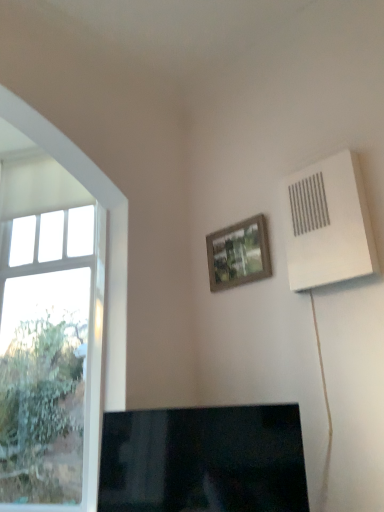
Question: Should I look upward or downward to see black glossy tv at lower center?

Choices:
 (A) down
 (B) up

Answer: (A)

Question: Is white plastic air conditioning unit at upper right facing away from clear glass window at left?

Choices:
 (A) no
 (B) yes

Answer: (A)

Question: Considering the relative sizes of white plastic air conditioning unit at upper right and clear glass window at left in the image provided, is white plastic air conditioning unit at upper right bigger than clear glass window at left?

Choices:
 (A) yes
 (B) no

Answer: (B)

Question: Is white plastic air conditioning unit at upper right further to camera compared to clear glass window at left?

Choices:
 (A) no
 (B) yes

Answer: (A)

Question: Is white plastic air conditioning unit at upper right not within clear glass window at left?

Choices:
 (A) no
 (B) yes

Answer: (B)

Question: From a real-world perspective, is white plastic air conditioning unit at upper right on clear glass window at left?

Choices:
 (A) no
 (B) yes

Answer: (B)

Question: Can you confirm if white plastic air conditioning unit at upper right is smaller than clear glass window at left?

Choices:
 (A) no
 (B) yes

Answer: (B)

Question: Is white plastic air conditioning unit at upper right taller than wooden frame at upper center?

Choices:
 (A) yes
 (B) no

Answer: (A)

Question: Does white plastic air conditioning unit at upper right turn towards wooden frame at upper center?

Choices:
 (A) yes
 (B) no

Answer: (B)

Question: Considering the relative sizes of white plastic air conditioning unit at upper right and wooden frame at upper center in the image provided, is white plastic air conditioning unit at upper right thinner than wooden frame at upper center?

Choices:
 (A) yes
 (B) no

Answer: (B)

Question: From the image's perspective, is white plastic air conditioning unit at upper right beneath wooden frame at upper center?

Choices:
 (A) yes
 (B) no

Answer: (B)

Question: Is wooden frame at upper center inside white plastic air conditioning unit at upper right?

Choices:
 (A) yes
 (B) no

Answer: (B)

Question: Can you confirm if white plastic air conditioning unit at upper right is positioned to the right of wooden frame at upper center?

Choices:
 (A) yes
 (B) no

Answer: (A)

Question: Is black glossy tv at lower center smaller than clear glass window at left?

Choices:
 (A) no
 (B) yes

Answer: (B)